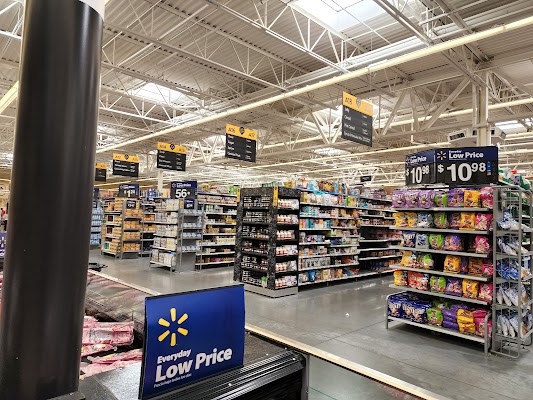
This screenshot has width=533, height=400. What are the coordinates of `shelves` in the screenshot? It's located at (447, 327), (454, 296), (455, 269), (457, 253), (457, 230), (457, 209).